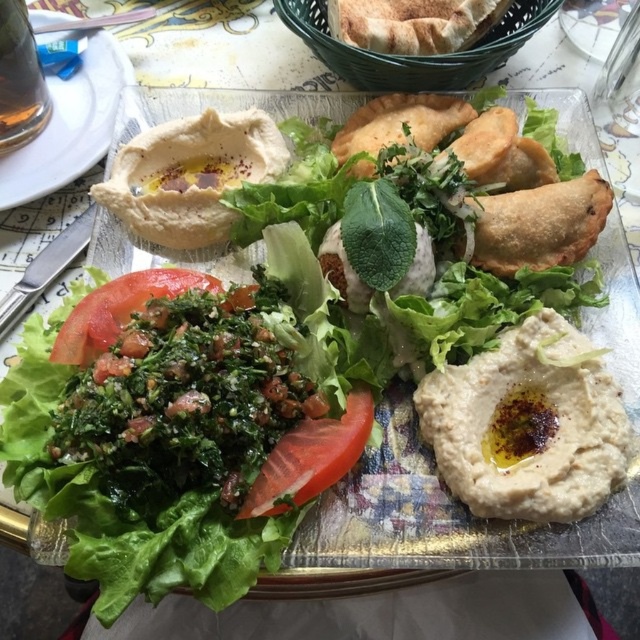
Question: Which of the following is the farthest from the observer?

Choices:
 (A) (296, 406)
 (B) (10, 140)
 (C) (138, 305)

Answer: (B)

Question: Which point is farther to the camera?

Choices:
 (A) (284, 506)
 (B) (28, 67)
 (C) (129, 426)

Answer: (B)

Question: Is red matte tomato at center to the left of transparent glass at upper left from the viewer's perspective?

Choices:
 (A) yes
 (B) no

Answer: (B)

Question: Where is green leafy salad at center located in relation to red matte tomato at center in the image?

Choices:
 (A) above
 (B) below

Answer: (A)

Question: Which object appears farthest from the camera in this image?

Choices:
 (A) red/greenish matte/tender tomato at center-left
 (B) transparent glass at upper left

Answer: (B)

Question: Does green leafy salad at center have a smaller size compared to transparent glass at upper left?

Choices:
 (A) yes
 (B) no

Answer: (B)